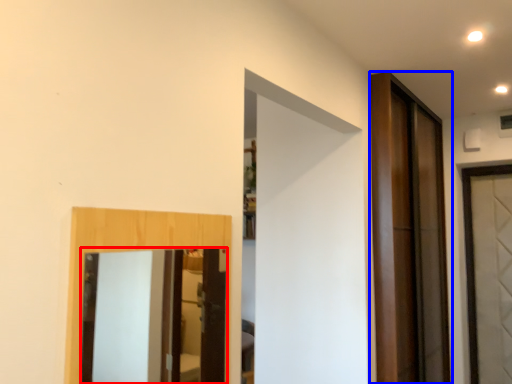
Question: Among these objects, which one is farthest to the camera, mirror (highlighted by a red box) or door (highlighted by a blue box)?

Choices:
 (A) mirror
 (B) door

Answer: (B)